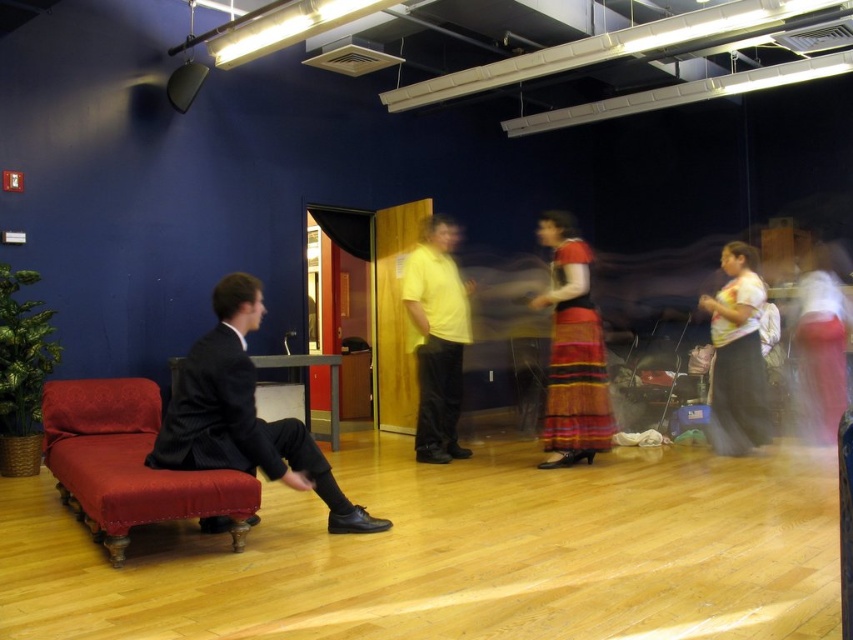
You are a photographer in the studio and need to position a light to the right of the black suit at left and to the left of the yellow matte shirt at center. Is there enough space between them for the light?

The black suit at left is positioned on the left side of yellow matte shirt at center, so there is space between them for the light.

You are standing in the dance studio and want to place a 2.5 meter long banner from your current position to the point at coordinates point (207, 436). Will the banner be long enough to reach that point?

The distance to point (207, 436) is 3.09 meters, so the 2.5 meter banner is not long enough to reach that point.